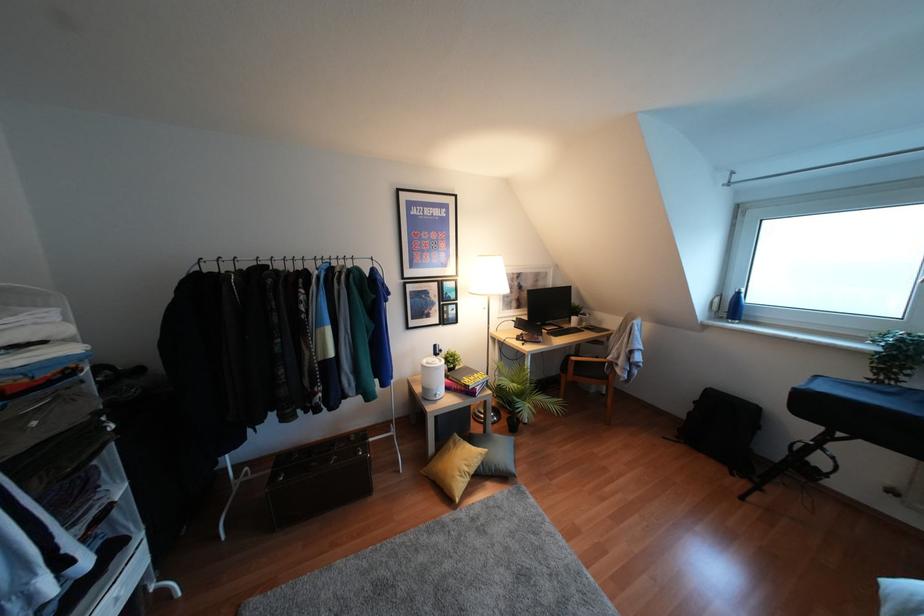
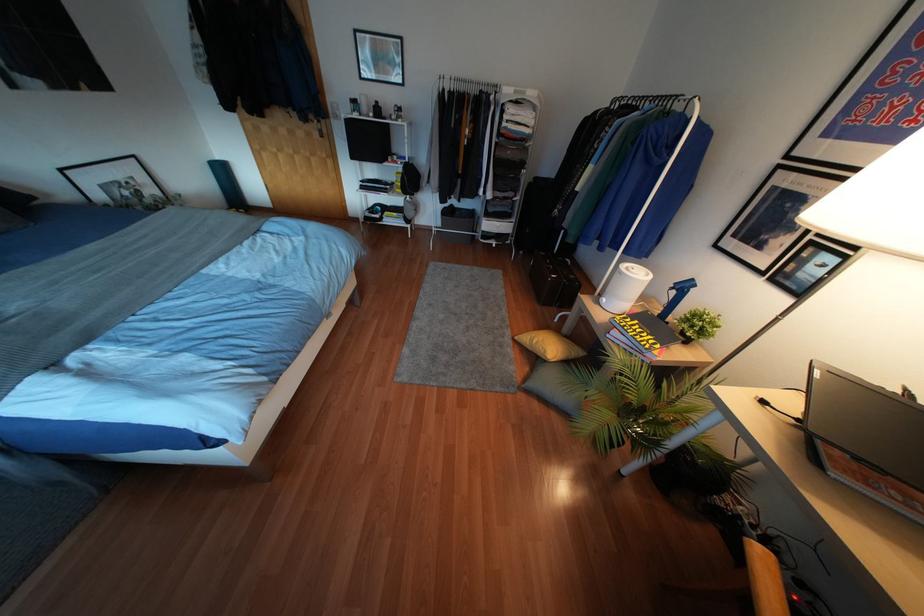
The point at (434, 345) is marked in the first image. Where is the corresponding point in the second image?

(690, 280)